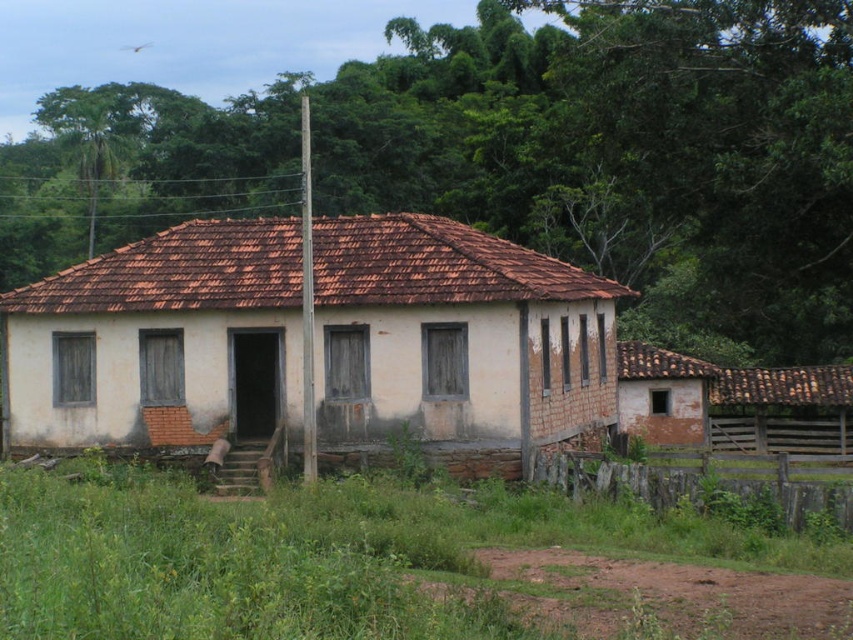
Question: Is white plastered wall at center wider than brown wooden fence at lower right?

Choices:
 (A) yes
 (B) no

Answer: (A)

Question: Does white plastered wall at center appear on the right side of brown wooden fence at lower right?

Choices:
 (A) no
 (B) yes

Answer: (A)

Question: Which point is farther from the camera taking this photo?

Choices:
 (A) (86, 372)
 (B) (585, 493)

Answer: (A)

Question: From the image, what is the correct spatial relationship of white plastered wall at center in relation to brown wooden fence at lower right?

Choices:
 (A) above
 (B) below

Answer: (A)